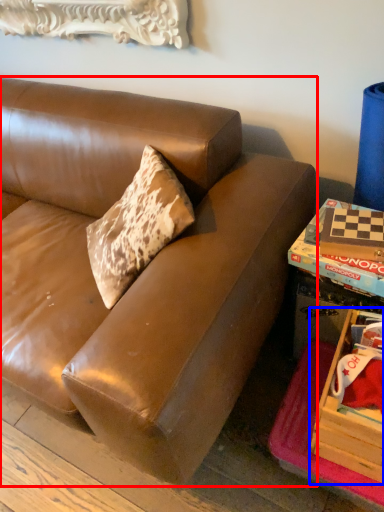
Question: Which object appears farthest to the camera in this image, studio couch (highlighted by a red box) or storage box (highlighted by a blue box)?

Choices:
 (A) studio couch
 (B) storage box

Answer: (B)